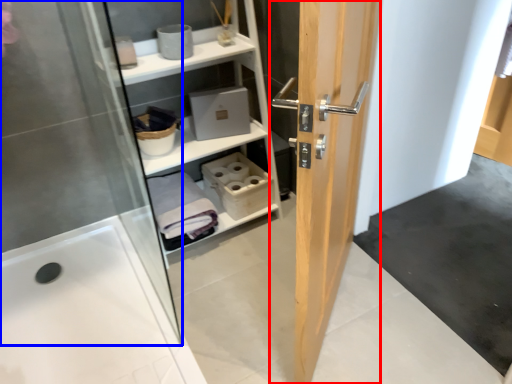
Question: Which of the following is the closest to the observer, door (highlighted by a red box) or screen door (highlighted by a blue box)?

Choices:
 (A) door
 (B) screen door

Answer: (A)